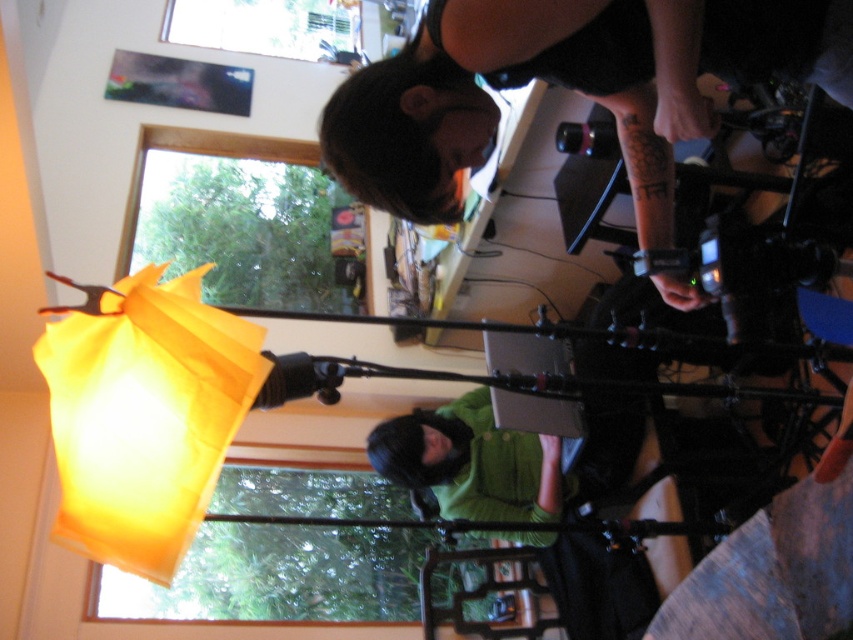
You are a photographer adjusting the lighting in the studio. The subject wearing the black matte shirt at upper center is positioned at coordinates 0.138 on the x and 0.666 on the y. To ensure proper lighting, you need to place a spotlight directly above their head. What are the coordinates where you should position the spotlight?

The coordinates for the spotlight should be directly above the black matte shirt at upper center, which is at point 0.138 on the x and 0.666 on the y. To place it directly above, you would adjust the y coordinate to a higher value while keeping the x coordinate the same, so the new coordinates would be approximately 0.138 on the x and 0.8 on the y.

You are setting up a photo shoot and need to position the black matte shirt at upper center and the yellow translucent paper lantern at left in the frame. According to the scene, which object should be placed to the right of the other?

The black matte shirt at upper center is positioned on the right side of yellow translucent paper lantern at left, so the black matte shirt at upper center should be placed to the right of the yellow translucent paper lantern at left.

You are a delivery robot with a package that needs to be placed between the yellow translucent paper lantern at left and the green matte shirt at lower center. The package is 1.5 meters long. Will it fit in the space between them?

The distance between the yellow translucent paper lantern at left and the green matte shirt at lower center is 1.54 meters. Since the package is 1.5 meters long, it will fit with a small amount of space remaining.